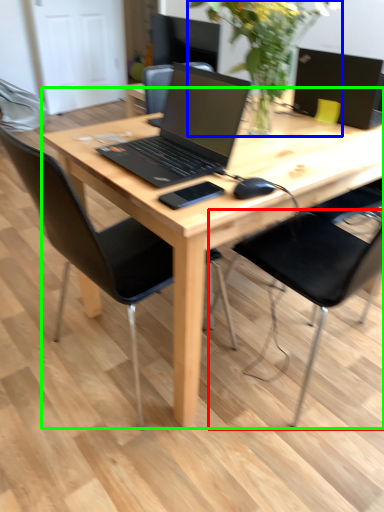
Question: Based on their relative distances, which object is nearer to chair (highlighted by a red box)? Choose from floral arrangement (highlighted by a blue box) and desk (highlighted by a green box).

Choices:
 (A) floral arrangement
 (B) desk

Answer: (B)